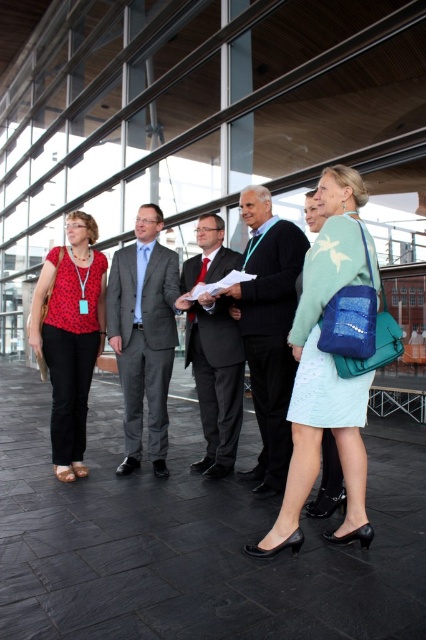
You are a photographer setting up for a group photo. You need to position a microphone stand between the mint green fabric dress at center and the dark blue suit at center. Which side of the microphone stand should face the wider object to ensure it doesn

The mint green fabric dress at center might be wider than dark blue suit at center, so the microphone stand should be positioned with its wider side facing the mint green fabric dress at center to accommodate its width.

You are organizing a photo shoot and need to place a small decorative item between the matte red blouse at left and the dark gray suit at center. Which object should the item be placed closer to based on their sizes?

The matte red blouse at left is smaller than the dark gray suit at center, so the item should be placed closer to the matte red blouse at left to balance the sizes.

You are standing in the same location as the photographer and want to place a small flag at the point closer to you between point (322, 180) and point (287, 307). Which point should you choose?

You should choose point (322, 180) because it is closer to the viewer than point (287, 307).